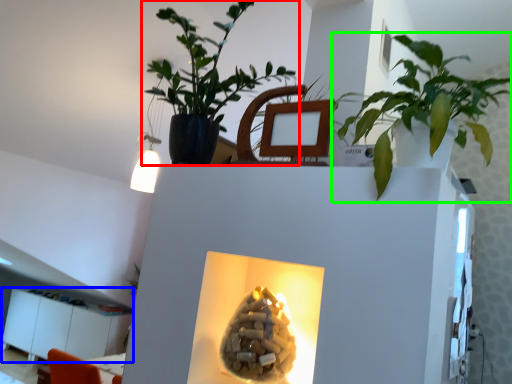
Question: Which is nearer to the houseplant (highlighted by a red box)? furniture (highlighted by a blue box) or houseplant (highlighted by a green box).

Choices:
 (A) furniture
 (B) houseplant

Answer: (B)